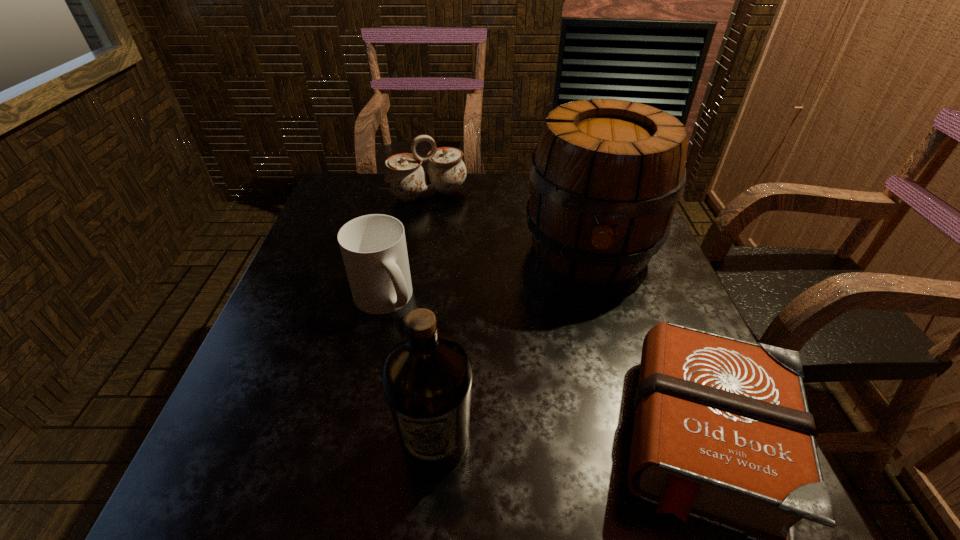
Locate an element on the screen. vacant space on the desktop that is between the olive oil and the Bible and is positioned on the handle side of the mug is located at coordinates (x=561, y=441).

Where is `vacant space on the desktop that is between the olive oil and the shortest object and is positioned by the handle of the farthest object`? The width and height of the screenshot is (960, 540). vacant space on the desktop that is between the olive oil and the shortest object and is positioned by the handle of the farthest object is located at coordinates tap(546, 441).

At what (x,y) coordinates should I click in order to perform the action: click on free space on the desktop that is between the olive oil and the shortest object and is positioned on the side of the cider where the spigot is located. Please return your answer as a coordinate pair (x, y). The height and width of the screenshot is (540, 960). Looking at the image, I should click on (591, 441).